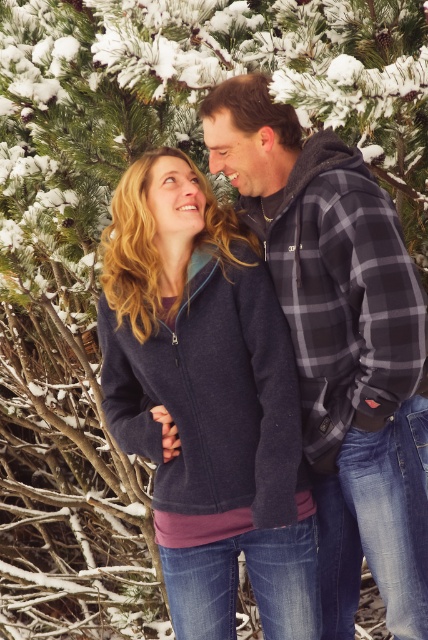
Does navy fleece jacket at center have a lesser width compared to plaid flannel shirt at center?

In fact, navy fleece jacket at center might be wider than plaid flannel shirt at center.

Between point (219, 342) and point (321, 576), which one is positioned in front?

Point (219, 342)

Who is more distant from viewer, (157, 540) or (357, 236)?

Positioned behind is point (157, 540).

Identify the location of navy fleece jacket at center. The image size is (428, 640). (207, 401).